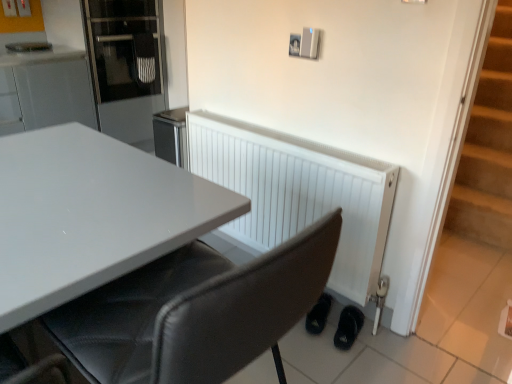
Measure the distance between black leather shoes at lower right, the 2th footwear from the right, and camera.

black leather shoes at lower right, the 2th footwear from the right, is 1.81 meters away from camera.

What is the approximate width of white matte radiator at lower right?

white matte radiator at lower right is 6.36 inches wide.

Measure the distance between white matte radiator at lower right and camera.

white matte radiator at lower right and camera are 5.11 feet apart.

What do you see at coordinates (195, 312) in the screenshot? I see `black leather chair at center` at bounding box center [195, 312].

This screenshot has width=512, height=384. What are the coordinates of `black leather shoes at lower right, which is counted as the 1th footwear, starting from the right` in the screenshot? It's located at point(348,327).

Is black leather shoes at lower right, the 1th footwear positioned from the left, inside black leather chair at center?

No, black leather shoes at lower right, the 1th footwear positioned from the left, is not surrounded by black leather chair at center.

What's the angular difference between black leather chair at center and black leather shoes at lower right, the 2th footwear from the right,'s facing directions?

The angular difference between black leather chair at center and black leather shoes at lower right, the 2th footwear from the right, is 117 degrees.

Which point is more distant from viewer, (314, 236) or (315, 316)?

Point (315, 316)

Does black leather shoes at lower right, the 2th footwear from the right, contain white matte radiator at lower right?

No, white matte radiator at lower right is not surrounded by black leather shoes at lower right, the 2th footwear from the right.

Does black leather shoes at lower right, the 2th footwear from the right, turn towards white matte radiator at lower right?

No, black leather shoes at lower right, the 2th footwear from the right, is not oriented towards white matte radiator at lower right.

Can you confirm if black leather shoes at lower right, the 2th footwear from the right, is shorter than white matte radiator at lower right?

Yes.

In the scene shown: From a real-world perspective, is black leather shoes at lower right, the 2th footwear from the right, over white matte radiator at lower right?

Incorrect, from a real-world perspective, black leather shoes at lower right, the 2th footwear from the right, is lower than white matte radiator at lower right.

Is glass door refrigerator at upper left outside of black leather shoes at lower right, the 1th footwear positioned from the left?

glass door refrigerator at upper left lies outside black leather shoes at lower right, the 1th footwear positioned from the left,'s area.

Could you tell me if glass door refrigerator at upper left is facing black leather shoes at lower right, the 1th footwear positioned from the left?

Yes, glass door refrigerator at upper left is oriented towards black leather shoes at lower right, the 1th footwear positioned from the left.

Image resolution: width=512 pixels, height=384 pixels. I want to click on appliance behind the black leather shoes at lower right, the 1th footwear positioned from the left, so click(x=125, y=65).

Is glass door refrigerator at upper left at the left side of black leather shoes at lower right, the 1th footwear positioned from the left?

Correct, you'll find glass door refrigerator at upper left to the left of black leather shoes at lower right, the 1th footwear positioned from the left.

Can you confirm if black leather shoes at lower right, which is the second footwear from left to right, is smaller than white matte radiator at lower right?

Indeed, black leather shoes at lower right, which is the second footwear from left to right, has a smaller size compared to white matte radiator at lower right.

Is the position of black leather shoes at lower right, which is the second footwear from left to right, less distant than that of white matte radiator at lower right?

That is False.

From a real-world perspective, relative to white matte radiator at lower right, is black leather shoes at lower right, which is counted as the 1th footwear, starting from the right, vertically above or below?

From a real-world perspective, black leather shoes at lower right, which is counted as the 1th footwear, starting from the right, is physically below white matte radiator at lower right.

From the image's perspective, would you say black leather shoes at lower right, which is counted as the 1th footwear, starting from the right, is shown under white matte radiator at lower right?

Indeed, from the image's perspective, black leather shoes at lower right, which is counted as the 1th footwear, starting from the right, is shown beneath white matte radiator at lower right.

Is black leather shoes at lower right, which is counted as the 1th footwear, starting from the right, at the back of white matte radiator at lower right?

No, white matte radiator at lower right is not facing the opposite direction of black leather shoes at lower right, which is counted as the 1th footwear, starting from the right.

How different are the orientations of white matte radiator at lower right and black leather shoes at lower right, which is counted as the 1th footwear, starting from the right, in degrees?

white matte radiator at lower right and black leather shoes at lower right, which is counted as the 1th footwear, starting from the right, are facing 22 degrees away from each other.

Is white matte radiator at lower right taller or shorter than black leather shoes at lower right, which is the second footwear from left to right?

Clearly, white matte radiator at lower right is taller compared to black leather shoes at lower right, which is the second footwear from left to right.

Would you consider white matte radiator at lower right to be distant from black leather shoes at lower right, which is the second footwear from left to right?

No, there isn't a large distance between white matte radiator at lower right and black leather shoes at lower right, which is the second footwear from left to right.

Is black leather shoes at lower right, which is the second footwear from left to right, not near black leather chair at center?

black leather shoes at lower right, which is the second footwear from left to right, is positioned a significant distance from black leather chair at center.

Does black leather shoes at lower right, which is the second footwear from left to right, have a greater height compared to black leather chair at center?

No.

Who is smaller, black leather shoes at lower right, which is counted as the 1th footwear, starting from the right, or black leather chair at center?

Smaller between the two is black leather shoes at lower right, which is counted as the 1th footwear, starting from the right.

Is point (345, 320) positioned before point (128, 126)?

Yes, it is in front of point (128, 126).

Consider the image. Is black leather shoes at lower right, which is the second footwear from left to right, turned away from glass door refrigerator at upper left?

black leather shoes at lower right, which is the second footwear from left to right, does not have its back to glass door refrigerator at upper left.

Is black leather shoes at lower right, which is the second footwear from left to right, next to glass door refrigerator at upper left and touching it?

No, black leather shoes at lower right, which is the second footwear from left to right, is not with glass door refrigerator at upper left.

Which is more to the right, black leather shoes at lower right, which is the second footwear from left to right, or glass door refrigerator at upper left?

Positioned to the right is black leather shoes at lower right, which is the second footwear from left to right.

Identify the location of the 2nd footwear behind the black leather chair at center, counting from the anchor's position. (319, 315).

From the white matte radiator at lower right, count 1st footwear to the right and point to it. Please provide its 2D coordinates.

[(319, 315)]

Based on their spatial positions, is black leather shoes at lower right, which is counted as the 1th footwear, starting from the right, or white matte radiator at lower right closer to black leather shoes at lower right, the 1th footwear positioned from the left?

Among the two, black leather shoes at lower right, which is counted as the 1th footwear, starting from the right, is located nearer to black leather shoes at lower right, the 1th footwear positioned from the left.

From the image, which object appears to be farther from white matte radiator at lower right, glass door refrigerator at upper left or black leather shoes at lower right, which is counted as the 1th footwear, starting from the right?

Based on the image, glass door refrigerator at upper left appears to be further to white matte radiator at lower right.

From the image, which object appears to be farther from glass door refrigerator at upper left, black leather shoes at lower right, which is the second footwear from left to right, or white matte radiator at lower right?

black leather shoes at lower right, which is the second footwear from left to right.

Which object lies nearer to the anchor point white matte radiator at lower right, black leather shoes at lower right, the 1th footwear positioned from the left, or black leather shoes at lower right, which is the second footwear from left to right?

black leather shoes at lower right, the 1th footwear positioned from the left, is positioned closer to the anchor white matte radiator at lower right.

Considering their positions, is black leather shoes at lower right, the 1th footwear positioned from the left, positioned closer to black leather shoes at lower right, which is counted as the 1th footwear, starting from the right, than black leather chair at center?

Based on the image, black leather shoes at lower right, the 1th footwear positioned from the left, appears to be nearer to black leather shoes at lower right, which is counted as the 1th footwear, starting from the right.

Based on the photo, based on their spatial positions, is black leather shoes at lower right, the 2th footwear from the right, or white matte radiator at lower right further from black leather shoes at lower right, which is counted as the 1th footwear, starting from the right?

white matte radiator at lower right is positioned further to the anchor black leather shoes at lower right, which is counted as the 1th footwear, starting from the right.

When comparing their distances from black leather shoes at lower right, the 2th footwear from the right, does glass door refrigerator at upper left or black leather chair at center seem further?

glass door refrigerator at upper left lies further to black leather shoes at lower right, the 2th footwear from the right, than the other object.

Considering their positions, is white matte radiator at lower right positioned further to black leather shoes at lower right, which is counted as the 1th footwear, starting from the right, than glass door refrigerator at upper left?

The object further to black leather shoes at lower right, which is counted as the 1th footwear, starting from the right, is glass door refrigerator at upper left.

Locate an element on the screen. This screenshot has width=512, height=384. radiator located between glass door refrigerator at upper left and black leather shoes at lower right, the 2th footwear from the right, in the left-right direction is located at coordinates (300, 196).

You are a GUI agent. You are given a task and a screenshot of the screen. Output one action in this format:
    pyautogui.click(x=<x>, y=<y>)
    Task: Click on the radiator between glass door refrigerator at upper left and black leather shoes at lower right, which is counted as the 1th footwear, starting from the right, in the horizontal direction
    The height and width of the screenshot is (384, 512).
    Given the screenshot: What is the action you would take?
    pyautogui.click(x=300, y=196)

Identify the location of footwear that lies between white matte radiator at lower right and black leather shoes at lower right, which is counted as the 1th footwear, starting from the right, from top to bottom. The height and width of the screenshot is (384, 512). (319, 315).

Image resolution: width=512 pixels, height=384 pixels. I want to click on footwear positioned between black leather chair at center and black leather shoes at lower right, the 2th footwear from the right, from near to far, so click(x=348, y=327).